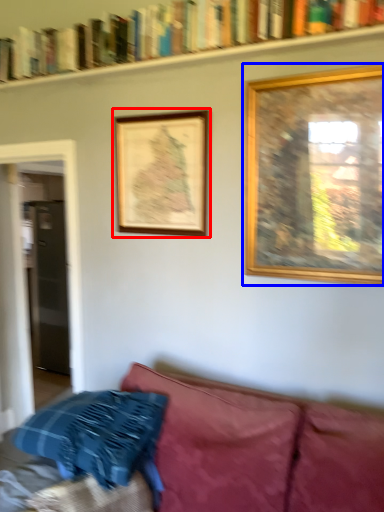
Question: Which object is further to the camera taking this photo, picture frame (highlighted by a red box) or picture frame (highlighted by a blue box)?

Choices:
 (A) picture frame
 (B) picture frame

Answer: (A)